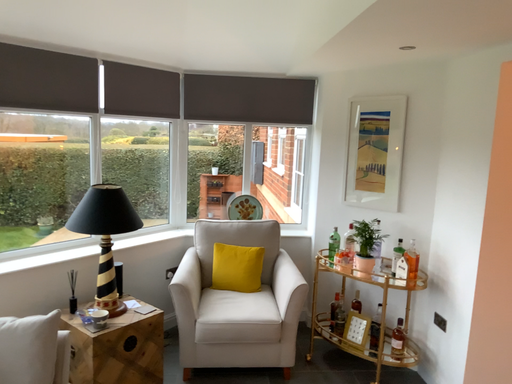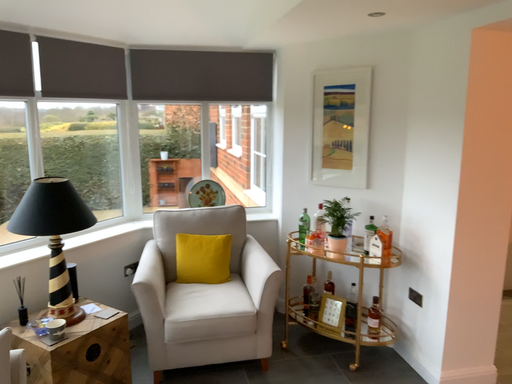
Question: Which way did the camera rotate in the video?

Choices:
 (A) rotated left
 (B) rotated right

Answer: (B)